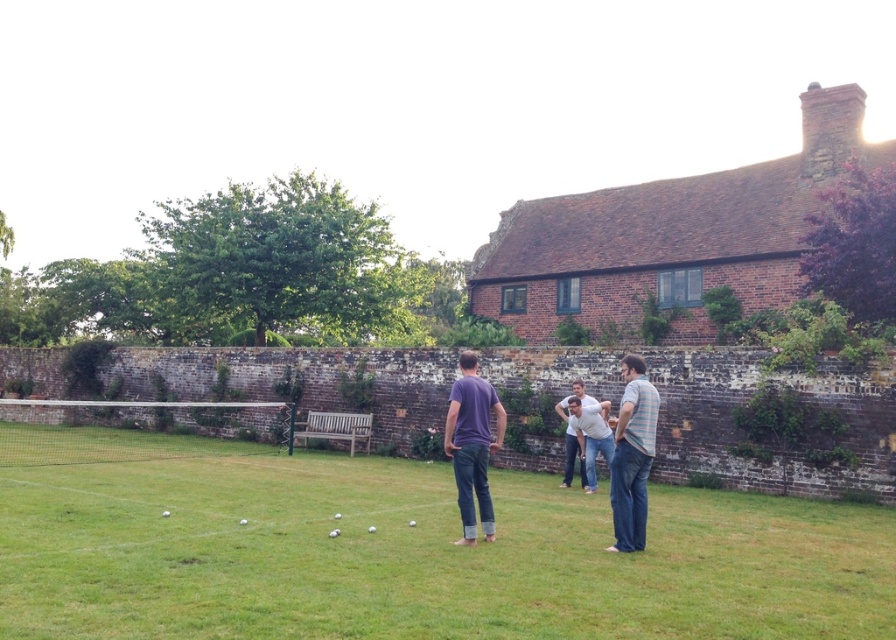
Question: Which object is farther from the camera taking this photo?

Choices:
 (A) denim jeans at center
 (B) purple cotton shirt at center

Answer: (A)

Question: Does green grass at center lie behind denim jeans at center?

Choices:
 (A) yes
 (B) no

Answer: (B)

Question: Does purple cotton shirt at center have a smaller size compared to denim jeans at center?

Choices:
 (A) no
 (B) yes

Answer: (A)

Question: Where is purple cotton shirt at center located in relation to striped cotton shirt at center in the image?

Choices:
 (A) left
 (B) right

Answer: (A)

Question: Estimate the real-world distances between objects in this image. Which object is closer to the purple cotton shirt at center?

Choices:
 (A) green grass at center
 (B) striped cotton shirt at center
 (C) denim jeans at center

Answer: (B)

Question: Which object is positioned closest to the green grass at center?

Choices:
 (A) purple cotton shirt at center
 (B) denim jeans at center

Answer: (B)